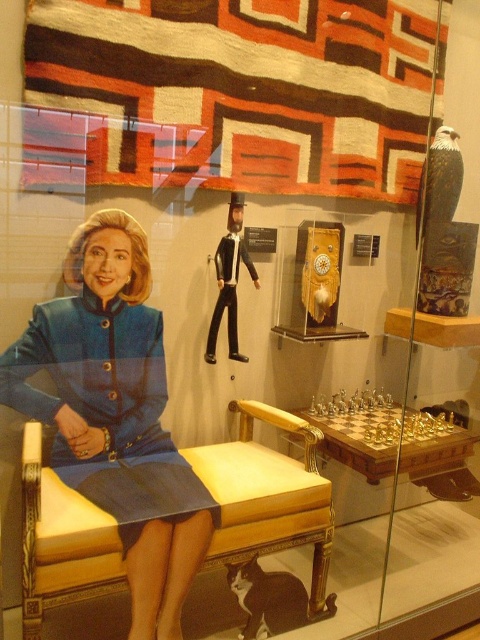
Question: Among these points, which one is farthest from the camera?

Choices:
 (A) pos(219,561)
 (B) pos(84,358)

Answer: (B)

Question: Which of the following is the closest to the observer?

Choices:
 (A) yellow upholstered chair at center
 (B) blue fabric dress at center

Answer: (B)

Question: Can you confirm if blue fabric dress at center is wider than yellow upholstered chair at center?

Choices:
 (A) no
 (B) yes

Answer: (B)

Question: Is blue fabric dress at center positioned in front of yellow upholstered chair at center?

Choices:
 (A) no
 (B) yes

Answer: (B)

Question: Which of the following is the farthest from the observer?

Choices:
 (A) (117, 497)
 (B) (275, 486)

Answer: (B)

Question: Does blue fabric dress at center have a lesser width compared to yellow upholstered chair at center?

Choices:
 (A) yes
 (B) no

Answer: (B)